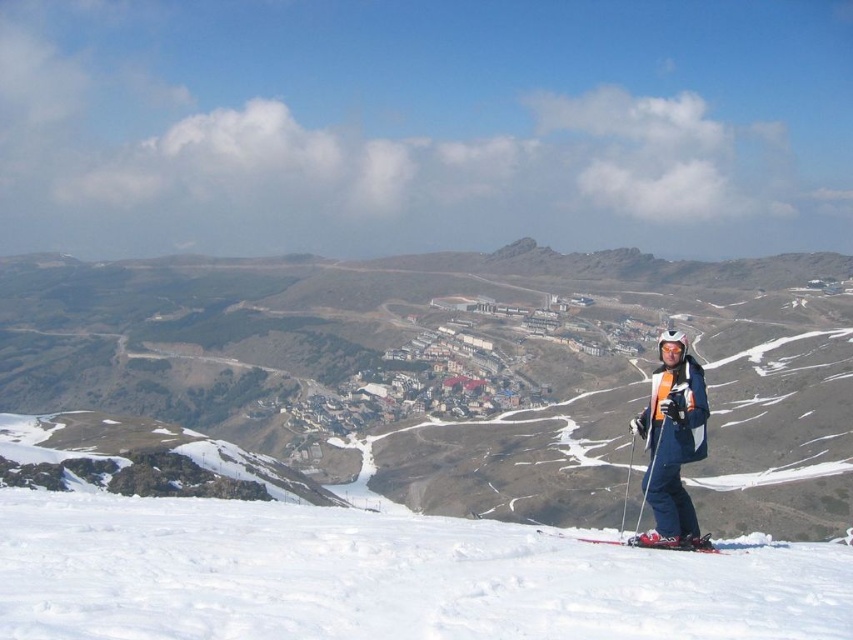
Question: Which point is closer to the camera?

Choices:
 (A) white powdery snow at lower center
 (B) blue fabric ski suit at lower right

Answer: (A)

Question: Is white powdery snow at lower center to the right of blue fabric ski suit at lower right from the viewer's perspective?

Choices:
 (A) yes
 (B) no

Answer: (B)

Question: Which object appears farthest from the camera in this image?

Choices:
 (A) shiny metallic ski at lower center
 (B) white powdery snow at lower center

Answer: (A)

Question: From the image, what is the correct spatial relationship of white powdery snow at lower center in relation to shiny metallic ski at lower center?

Choices:
 (A) below
 (B) above

Answer: (B)

Question: Which point appears closest to the camera in this image?

Choices:
 (A) (618, 541)
 (B) (561, 596)

Answer: (B)

Question: From the image, what is the correct spatial relationship of white powdery snow at lower center in relation to shiny metallic ski at lower center?

Choices:
 (A) right
 (B) left

Answer: (B)